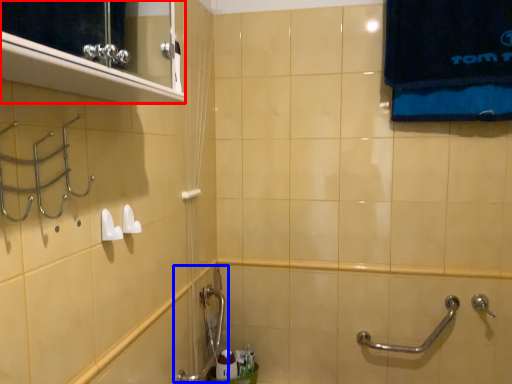
Question: Which object appears farthest to the camera in this image, medicine cabinet (highlighted by a red box) or plumbing fixture (highlighted by a blue box)?

Choices:
 (A) medicine cabinet
 (B) plumbing fixture

Answer: (B)